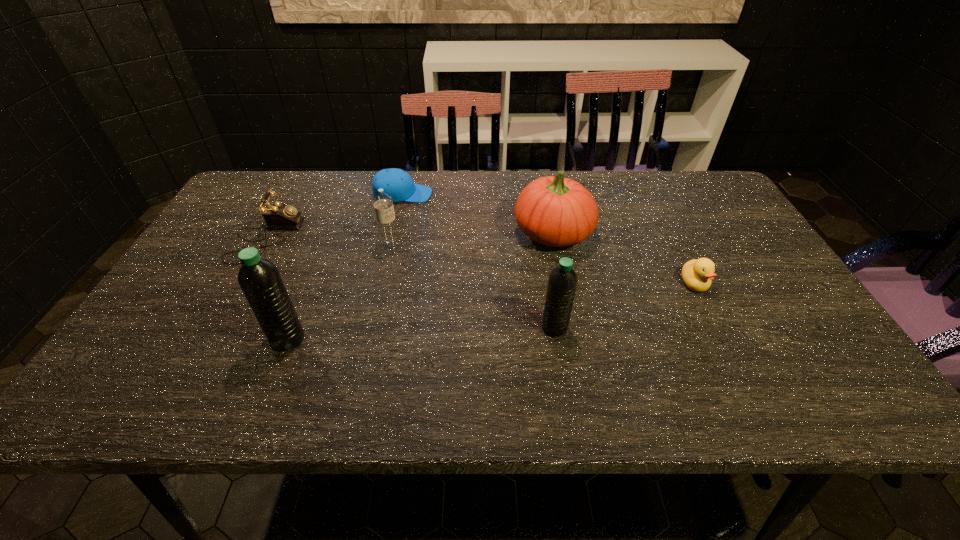
The water bottles are evenly distributed in the image. To maintain this, where would you place another water bottle on the right? Please point to a free space. Please provide its 2D coordinates. Your answer should be formatted as a tuple, i.e. [(x, y)], where the tuple contains the x and y coordinates of a point satisfying the conditions above.

[(809, 317)]